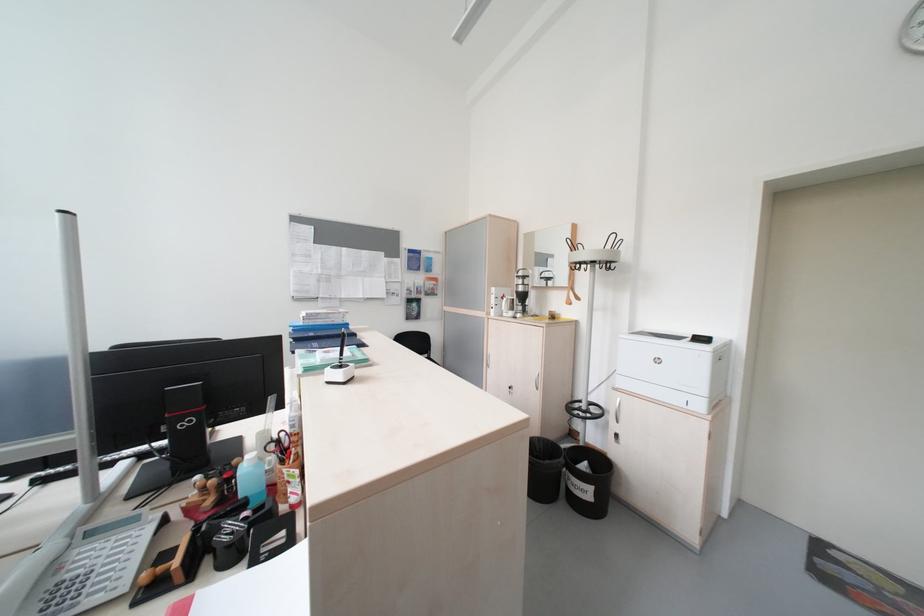
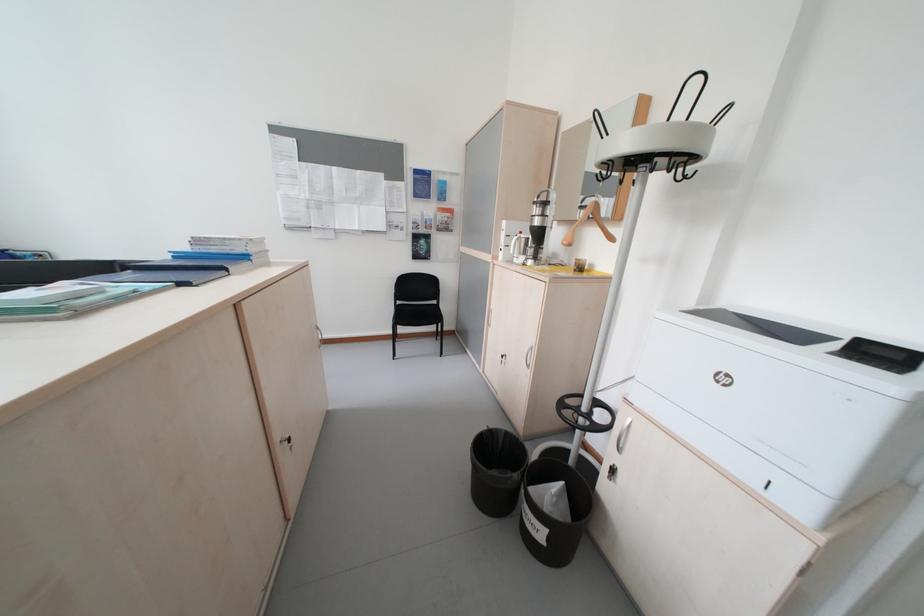
Question: Based on the continuous images, in which direction is the camera rotating? Reply with the corresponding letter.

Choices:
 (A) Left
 (B) Right
 (C) Up
 (D) Down

Answer: (A)